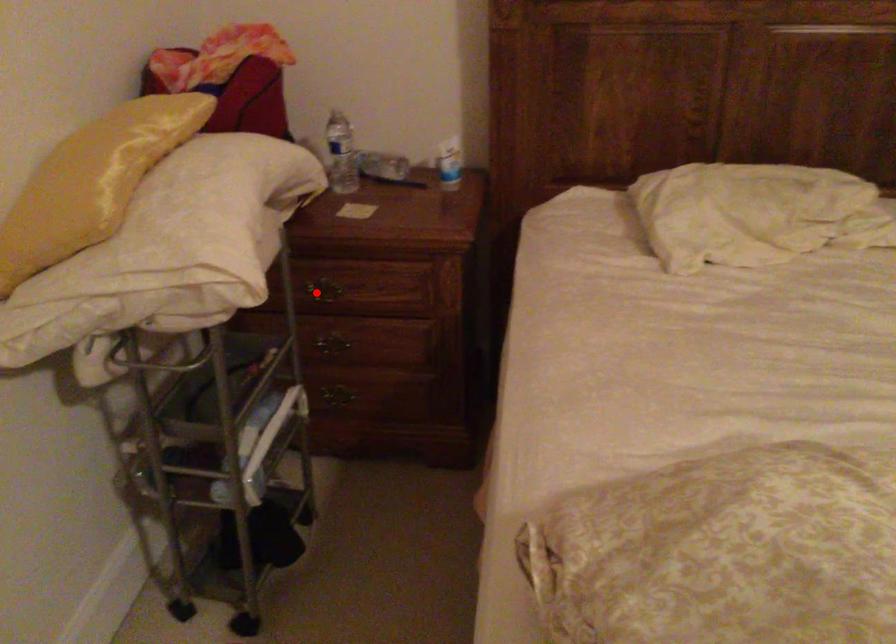
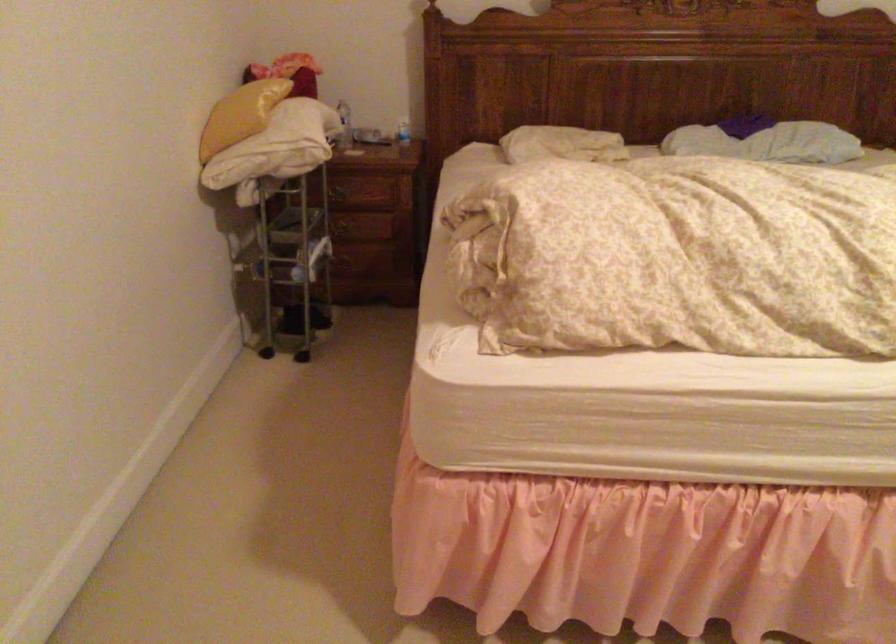
Question: I am providing you with two images of the same scene from different viewpoints. In image1, a red point is highlighted. Considering the same 3D point in image2, which of the following is correct?

Choices:
 (A) It is closer
 (B) It is farther

Answer: (B)